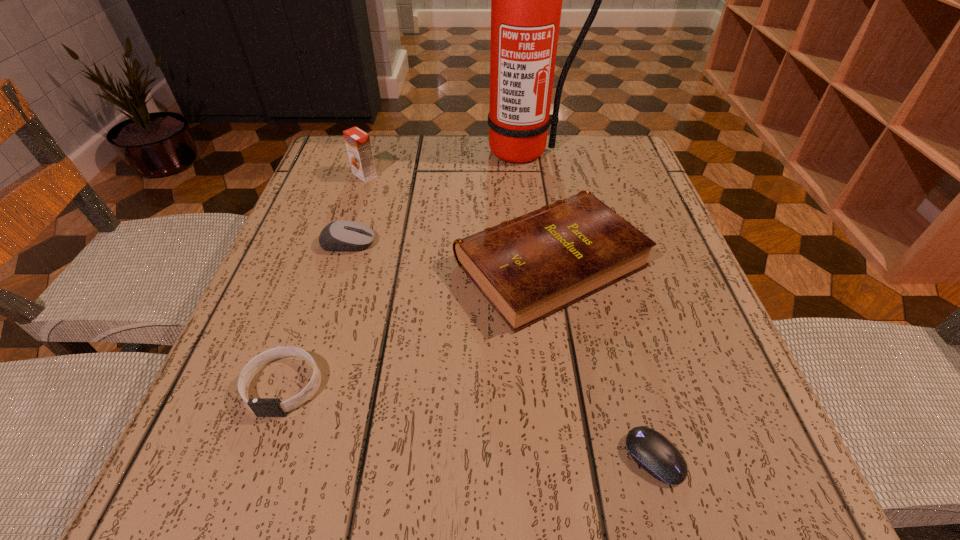
Find the location of `vacant region that satisfies the following two spatial constraints: 1. on the wheel side of the taller computer mouse; 2. on the back side of the hardback book`. vacant region that satisfies the following two spatial constraints: 1. on the wheel side of the taller computer mouse; 2. on the back side of the hardback book is located at coordinates (342, 264).

Find the location of a particular element. Image resolution: width=960 pixels, height=540 pixels. blank space that satisfies the following two spatial constraints: 1. on the handle side of the nearer computer mouse; 2. on the left side of the farthest object is located at coordinates (564, 457).

This screenshot has width=960, height=540. I want to click on vacant area in the image that satisfies the following two spatial constraints: 1. on the wheel side of the farther computer mouse; 2. on the back side of the third tallest object, so click(342, 264).

Image resolution: width=960 pixels, height=540 pixels. What are the coordinates of `blank area in the image that satisfies the following two spatial constraints: 1. on the handle side of the shorter computer mouse; 2. on the left side of the fire extinguisher` in the screenshot? It's located at (564, 457).

Locate an element on the screen. free space that satisfies the following two spatial constraints: 1. on the outer surface of the nearest object; 2. on the left side of the wristband is located at coordinates (258, 457).

The height and width of the screenshot is (540, 960). I want to click on vacant region that satisfies the following two spatial constraints: 1. on the handle side of the hardback book; 2. on the left side of the fire extinguisher, so click(539, 264).